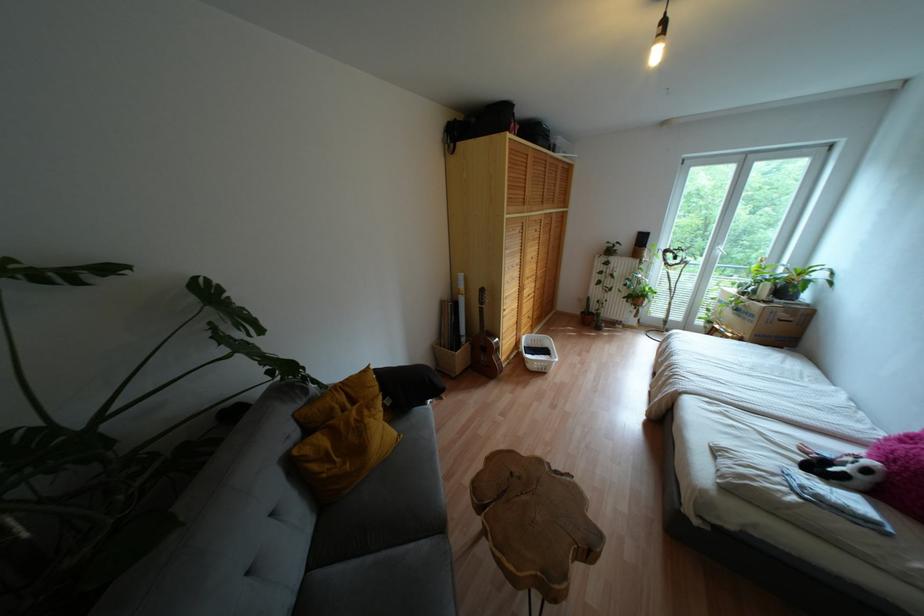
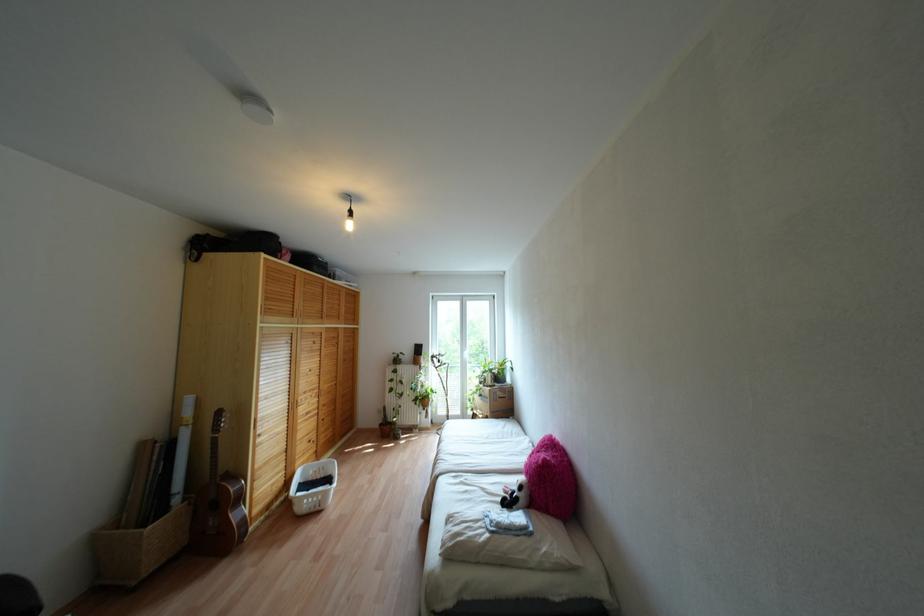
Locate, in the second image, the point that corresponds to [542,370] in the first image.

(317, 508)